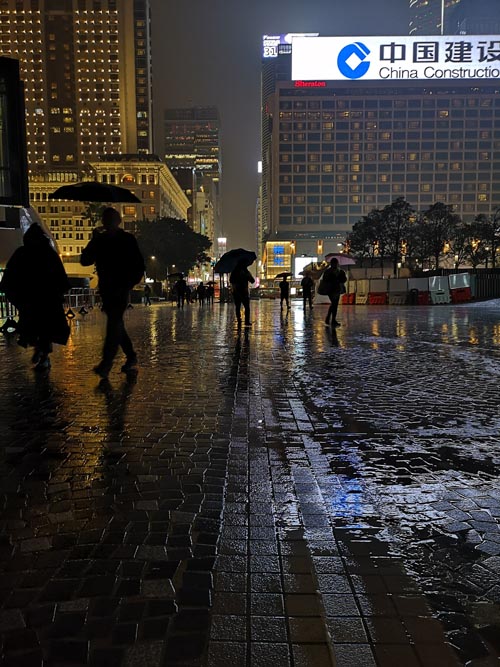
The height and width of the screenshot is (667, 500). In order to click on wet floor in this screenshot , I will do pos(175,432), pos(439,452), pos(295,339).